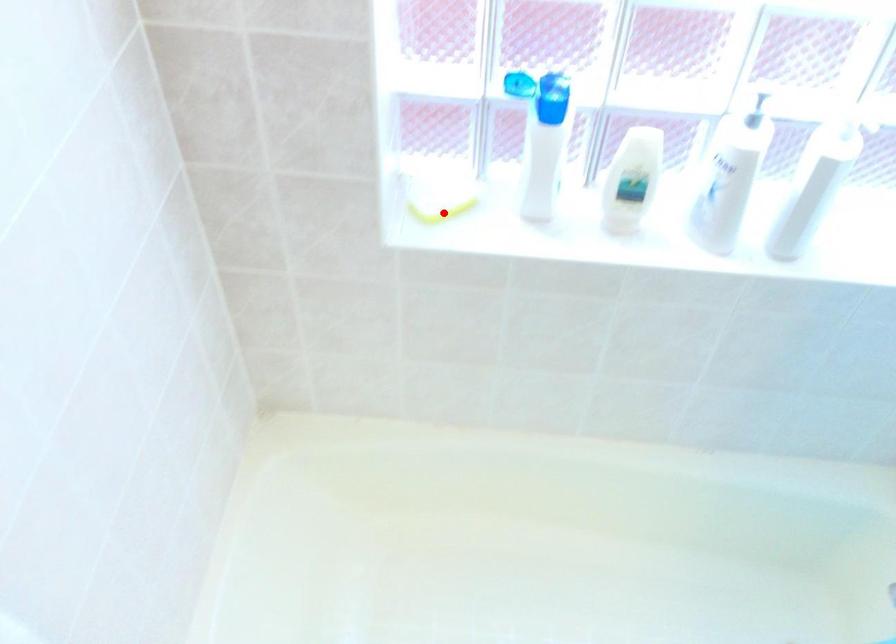
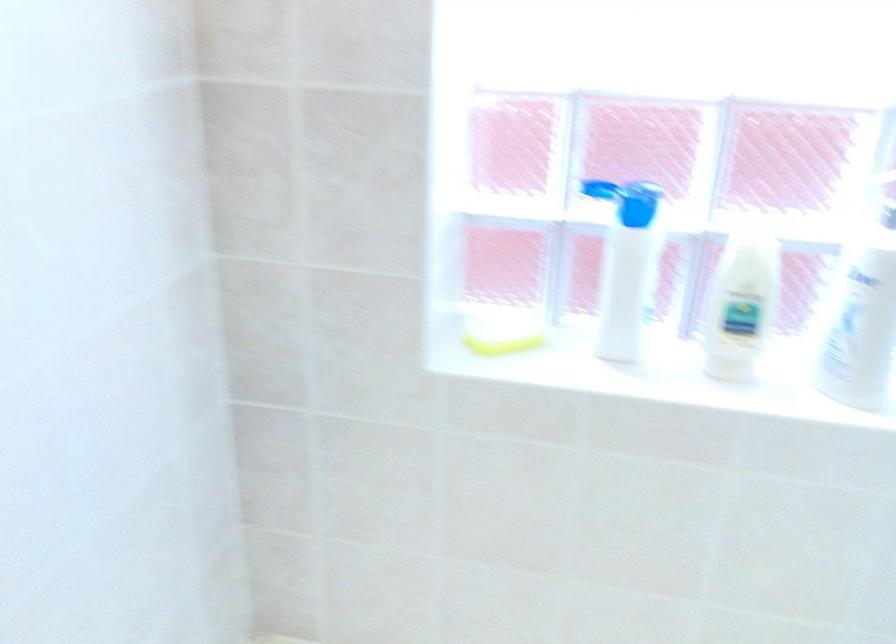
Locate, in the second image, the point that corresponds to the highlighted location in the first image.

(503, 344)